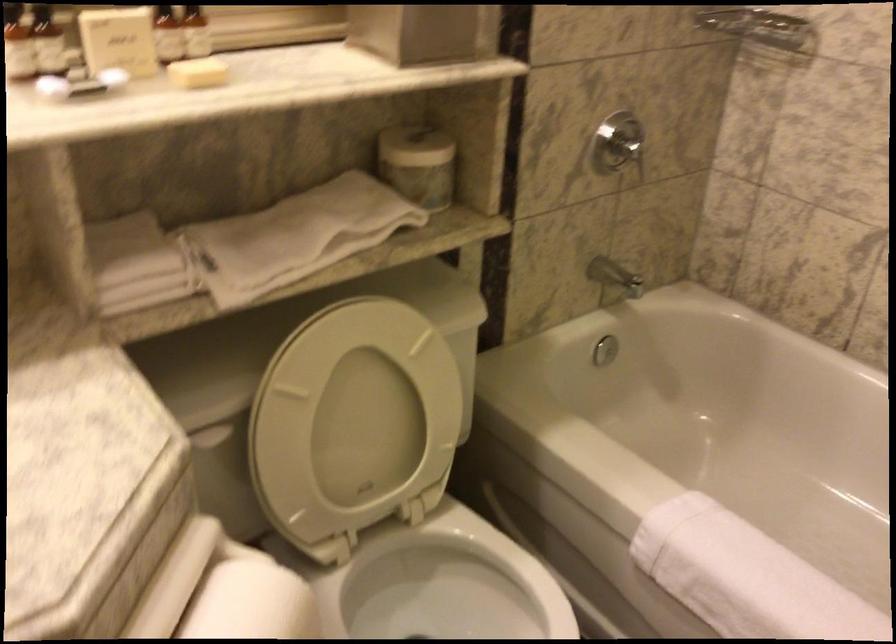
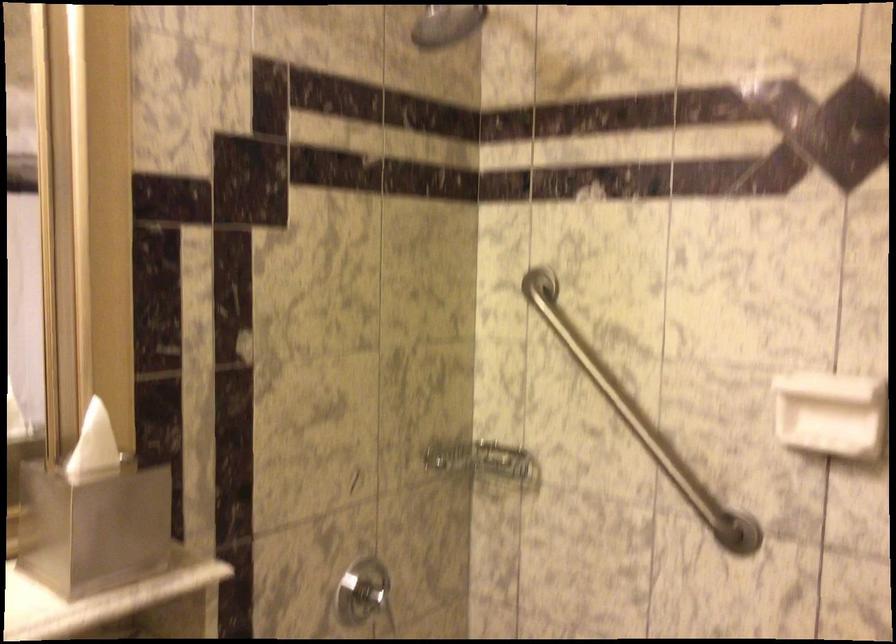
How did the camera likely rotate?

The camera rotated toward right-up.